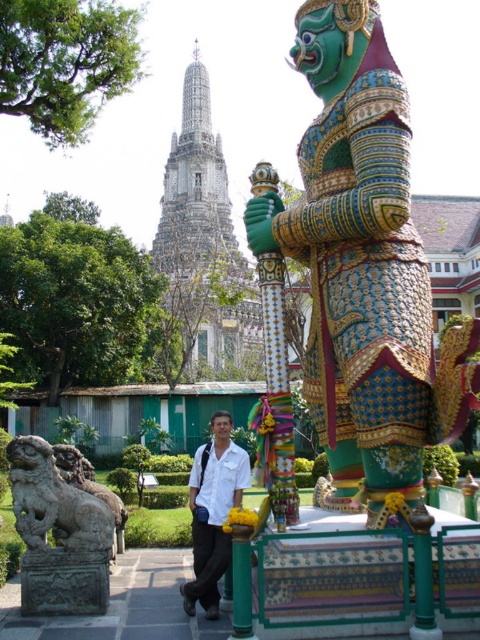
Identify the location of green textured armor at center. (364, 269).

Consider the image. Can you confirm if green textured armor at center is positioned to the right of gray stone lion at lower left?

Yes, green textured armor at center is to the right of gray stone lion at lower left.

Between point (333, 157) and point (88, 497), which one is positioned in front?

Point (333, 157)

Where is `green textured armor at center`? The width and height of the screenshot is (480, 640). green textured armor at center is located at coordinates (364, 269).

Is white stone temple at upper center bigger than white matte shirt at center?

Yes.

Between white stone temple at upper center and white matte shirt at center, which one is positioned lower?

white matte shirt at center is lower down.

This screenshot has height=640, width=480. What are the coordinates of `white stone temple at upper center` in the screenshot? It's located at (204, 244).

What are the coordinates of `white stone temple at upper center` in the screenshot? It's located at (204, 244).

Does white stone temple at upper center appear over gray stone lion at lower left?

Indeed, white stone temple at upper center is positioned over gray stone lion at lower left.

Between white stone temple at upper center and gray stone lion at lower left, which one appears on the left side from the viewer's perspective?

From the viewer's perspective, white stone temple at upper center appears more on the left side.

What do you see at coordinates (204, 244) in the screenshot? This screenshot has width=480, height=640. I see `white stone temple at upper center` at bounding box center [204, 244].

Find the location of a particular element. The width and height of the screenshot is (480, 640). white stone temple at upper center is located at coordinates (204, 244).